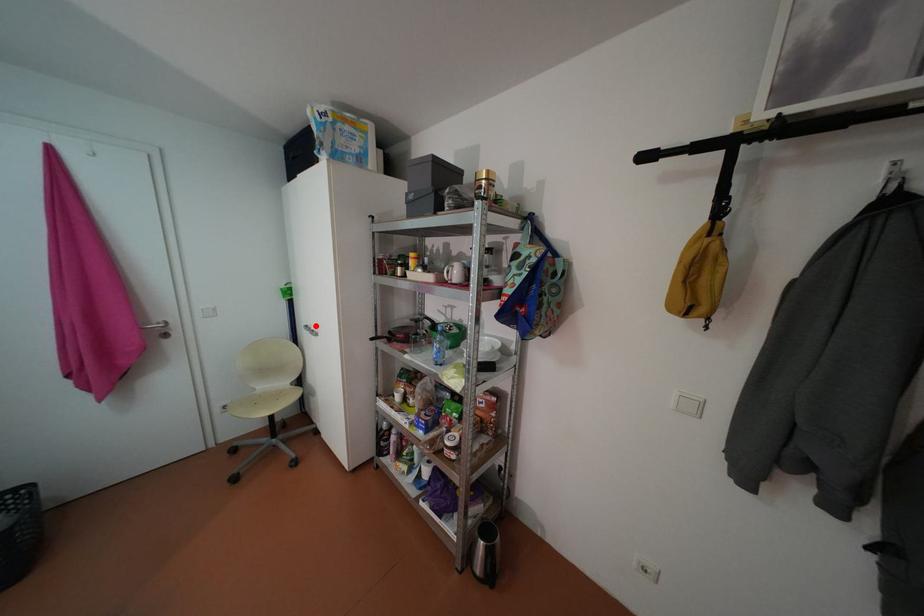
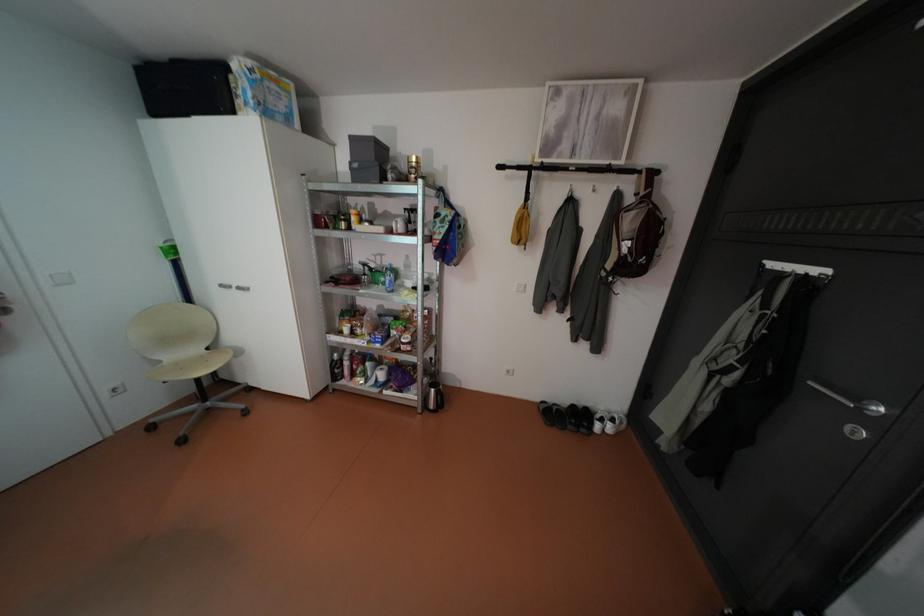
Question: I am providing you with two images of the same scene from different viewpoints. In image1, a red point is highlighted. Considering the same 3D point in image2, which of the following is correct?

Choices:
 (A) It is closer
 (B) It is farther

Answer: (A)